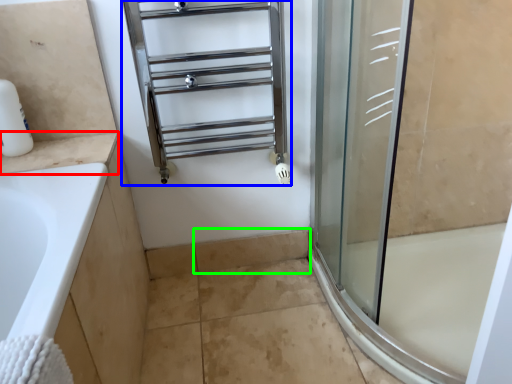
Question: Based on their relative distances, which object is nearer to counter top (highlighted by a red box)? Choose from shelf (highlighted by a blue box) and tile (highlighted by a green box).

Choices:
 (A) shelf
 (B) tile

Answer: (A)